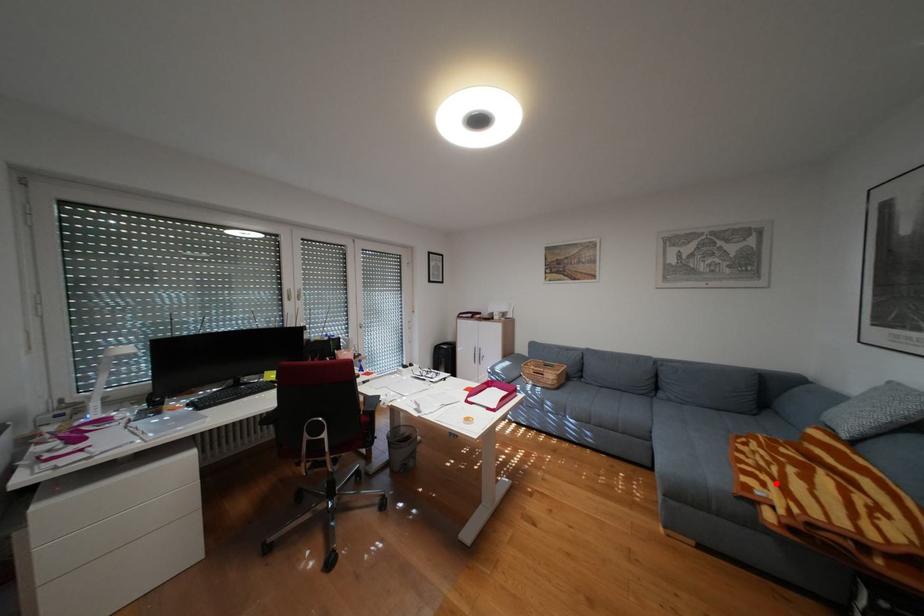
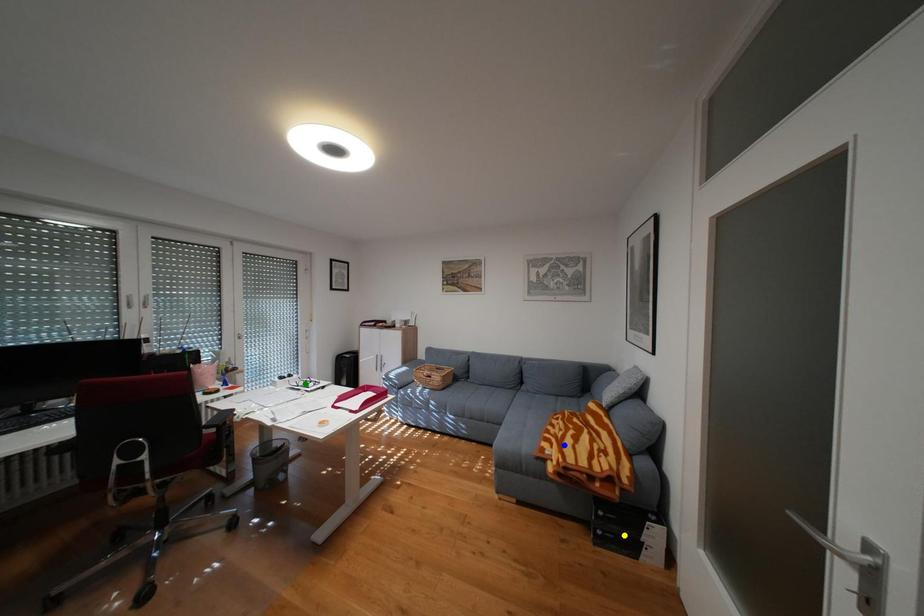
Question: I am providing you with two images of the same scene from different viewpoints. A red point is marked on the first image. You are given multiple points on the second image. Which spot in image 2 lines up with the point in image 1?

Choices:
 (A) green point
 (B) yellow point
 (C) blue point

Answer: (C)